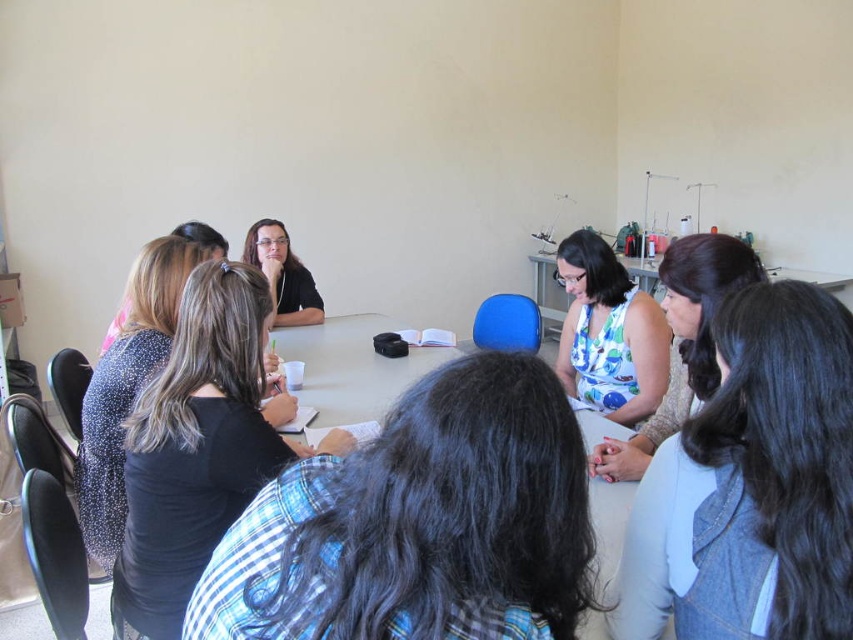
You are standing in the classroom and want to reach the point at coordinates point (212,570). If your arm is 30 inches long, can you reach it without moving your feet?

The distance between you and the point (212,570) is 33.62 inches, which is longer than your arm length of 30 inches. Therefore, you cannot reach it without moving your feet.

You are a photographer standing at the back of the room. You want to take a photo that includes both the black fabric shirt at center and the blue floral dress at center. What is the minimum distance you need to move forward to ensure both are in frame?

The black fabric shirt at center and blue floral dress at center are 1.69 meters apart. To capture both in the frame, you need to move forward until your camera can encompass a 1.69 meter width within its field of view.

In the classroom scene, there are two people wearing a gray fabric shirt at lower right and a black textured shirt at upper left. Which shirt is positioned to the right of the other?

The gray fabric shirt at lower right is positioned to the right of the black textured shirt at upper left.